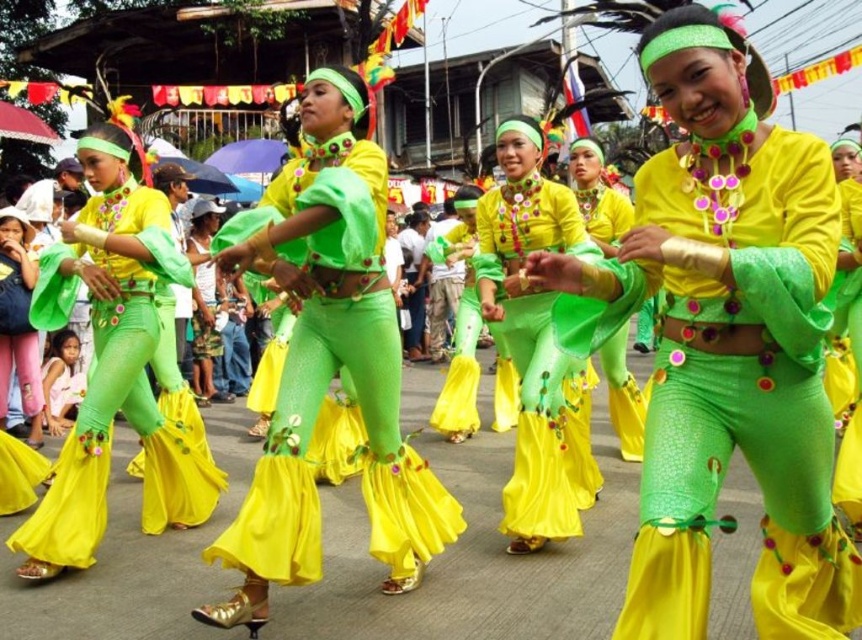
Does shiny green fabric dress at center appear under matte green fabric at lower left?

Actually, shiny green fabric dress at center is above matte green fabric at lower left.

Which is more to the right, shiny green fabric dress at center or matte green fabric at lower left?

shiny green fabric dress at center

Locate an element on the screen. The image size is (862, 640). shiny green fabric dress at center is located at coordinates (328, 362).

Consider the image. Can you confirm if shiny green fabric skirt at left is shorter than shiny green fabric skirt at center?

No, shiny green fabric skirt at left is not shorter than shiny green fabric skirt at center.

Can you confirm if shiny green fabric skirt at left is positioned to the left of shiny green fabric skirt at center?

Correct, you'll find shiny green fabric skirt at left to the left of shiny green fabric skirt at center.

Does point (25, 554) come closer to viewer compared to point (573, 252)?

Yes, point (25, 554) is in front of point (573, 252).

Identify the location of shiny green fabric skirt at left. The height and width of the screenshot is (640, 862). (113, 364).

Between shiny green fabric skirt at left and matte green fabric at lower left, which one has less height?

matte green fabric at lower left is shorter.

Can you confirm if shiny green fabric skirt at left is positioned to the right of matte green fabric at lower left?

Correct, you'll find shiny green fabric skirt at left to the right of matte green fabric at lower left.

Is point (58, 310) farther from camera compared to point (30, 349)?

No, (58, 310) is closer to viewer.

Identify the location of shiny green fabric skirt at left. This screenshot has width=862, height=640. (113, 364).